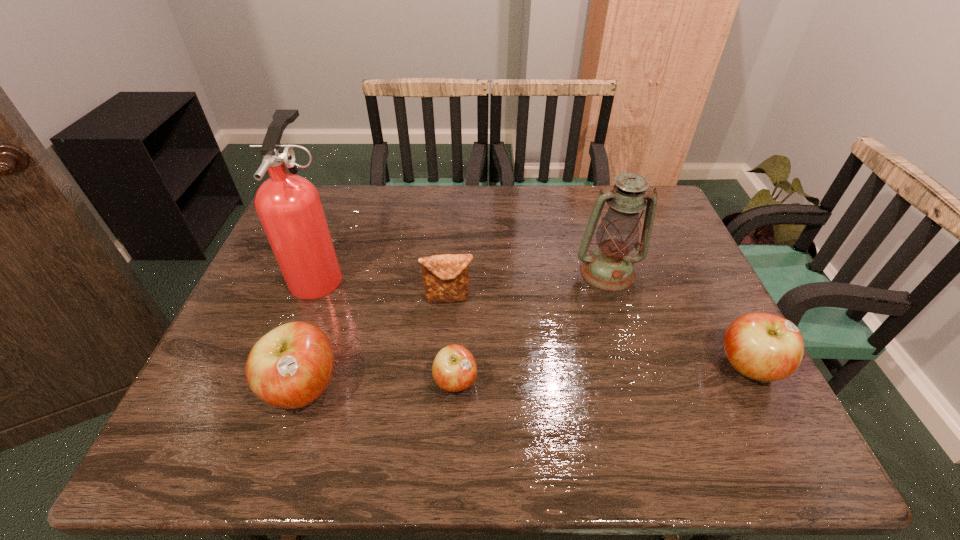
The width and height of the screenshot is (960, 540). What are the coordinates of `free space between the leftmost apple and the oil lamp` in the screenshot? It's located at (455, 330).

The height and width of the screenshot is (540, 960). Find the location of `vacant area between the clutch bag and the oil lamp`. vacant area between the clutch bag and the oil lamp is located at coordinates (528, 285).

This screenshot has height=540, width=960. Find the location of `free spot between the leftmost apple and the clutch bag`. free spot between the leftmost apple and the clutch bag is located at coordinates (376, 343).

The height and width of the screenshot is (540, 960). Find the location of `the third closest object relative to the leftmost apple`. the third closest object relative to the leftmost apple is located at coordinates (445, 277).

Select which object appears as the second closest to the fire extinguisher. Please provide its 2D coordinates. Your answer should be formatted as a tuple, i.e. [(x, y)], where the tuple contains the x and y coordinates of a point satisfying the conditions above.

[(445, 277)]

Where is `apple that is the nearest to the second shortest apple`? apple that is the nearest to the second shortest apple is located at coordinates (454, 369).

Locate an element on the screen. This screenshot has width=960, height=540. the second closest apple to the second apple from left to right is located at coordinates (765, 347).

Find the location of a particular element. free point that satisfies the following two spatial constraints: 1. on the back side of the leftmost apple; 2. on the right side of the fifth shortest object is located at coordinates (342, 272).